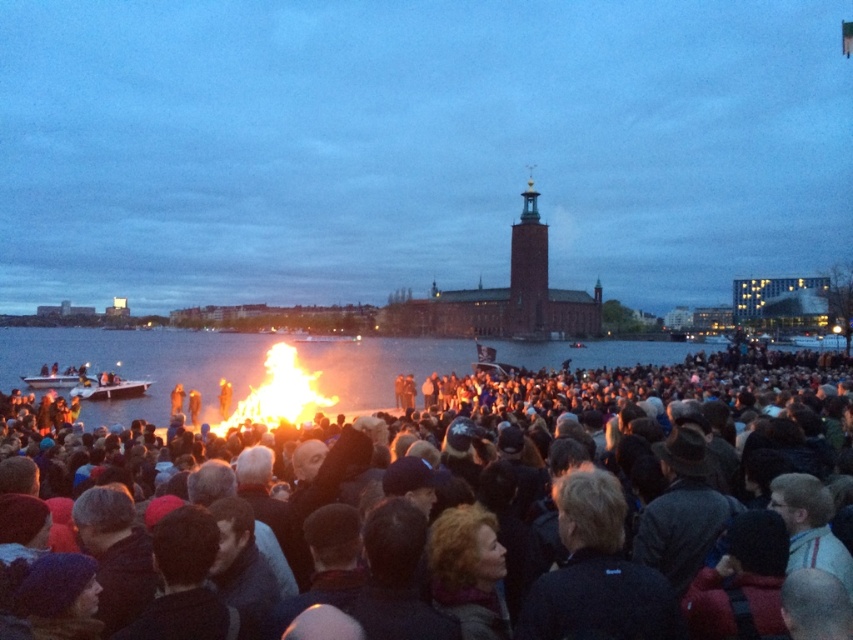
Which of these two, brick building at center or flaming wood at center, stands shorter?

flaming wood at center

Can you confirm if brick building at center is taller than flaming wood at center?

Indeed, brick building at center has a greater height compared to flaming wood at center.

Is point (592, 252) positioned behind point (238, 422)?

Yes, it is.

Where is `brick building at center`? brick building at center is located at coordinates (416, 147).

Does dark clothing crowd at center lie in front of flaming wood at center?

Yes, it is.

Is point (831, 499) closer to viewer compared to point (241, 422)?

Yes, point (831, 499) is closer to viewer.

Which is behind, point (556, 584) or point (320, 372)?

Point (320, 372)

The width and height of the screenshot is (853, 640). I want to click on dark clothing crowd at center, so click(x=488, y=513).

Between brick building at center and dark clothing crowd at center, which one has more height?

brick building at center

Is point (680, 154) farther from camera compared to point (283, 516)?

Yes.

The height and width of the screenshot is (640, 853). I want to click on brick building at center, so (416, 147).